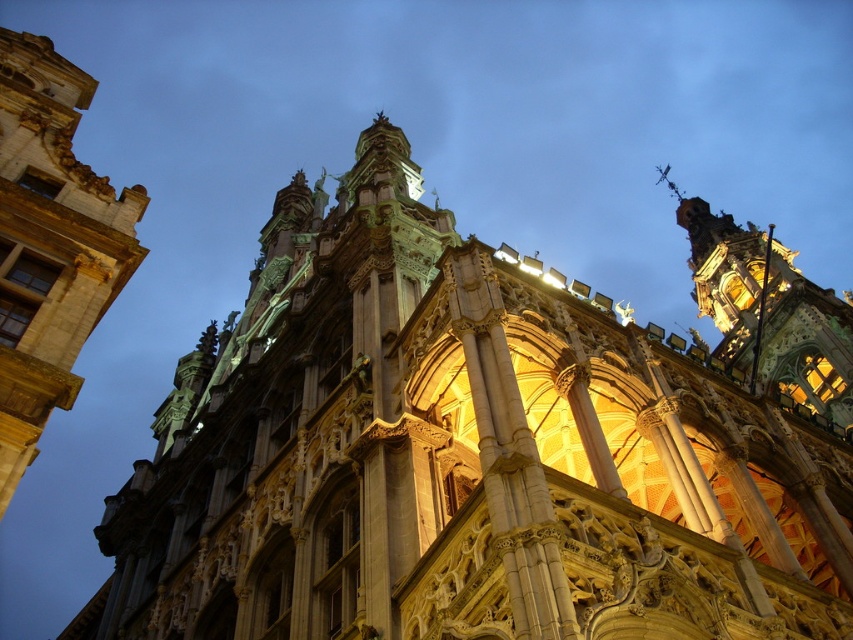
Question: Observing the image, what is the correct spatial positioning of golden stone tower at upper left in reference to gold ornate tower at upper right?

Choices:
 (A) right
 (B) left

Answer: (B)

Question: Which of the following is the closest to the observer?

Choices:
 (A) (67, 131)
 (B) (730, 225)

Answer: (A)

Question: In this image, where is golden stone tower at upper left located relative to gold ornate tower at upper right?

Choices:
 (A) above
 (B) below

Answer: (B)

Question: Which point is farther to the camera?

Choices:
 (A) gold ornate tower at upper right
 (B) golden stone tower at upper left

Answer: (A)

Question: Does golden stone tower at upper left appear under gold ornate tower at upper right?

Choices:
 (A) yes
 (B) no

Answer: (A)

Question: Which point is farther to the camera?

Choices:
 (A) gold ornate tower at upper right
 (B) golden stone tower at upper left

Answer: (A)